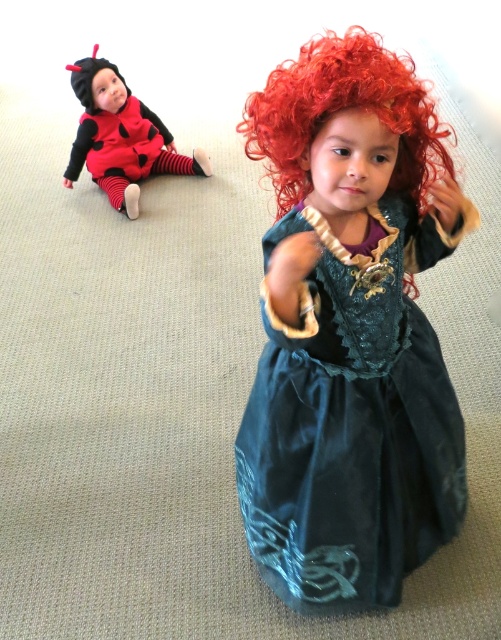
Question: Is teal velvet dress at center behind matte black and red costume at upper left?

Choices:
 (A) no
 (B) yes

Answer: (A)

Question: Which object appears closest to the camera in this image?

Choices:
 (A) teal velvet dress at center
 (B) curly red wig at center
 (C) matte black and red costume at upper left

Answer: (A)

Question: Does curly red wig at center appear on the left side of matte black and red costume at upper left?

Choices:
 (A) no
 (B) yes

Answer: (A)

Question: Which object is closer to the camera taking this photo?

Choices:
 (A) matte black and red costume at upper left
 (B) curly red wig at center

Answer: (B)

Question: Which point is farther from the camera taking this photo?

Choices:
 (A) (426, 104)
 (B) (407, 492)

Answer: (B)

Question: Does teal velvet dress at center appear over matte black and red costume at upper left?

Choices:
 (A) yes
 (B) no

Answer: (B)